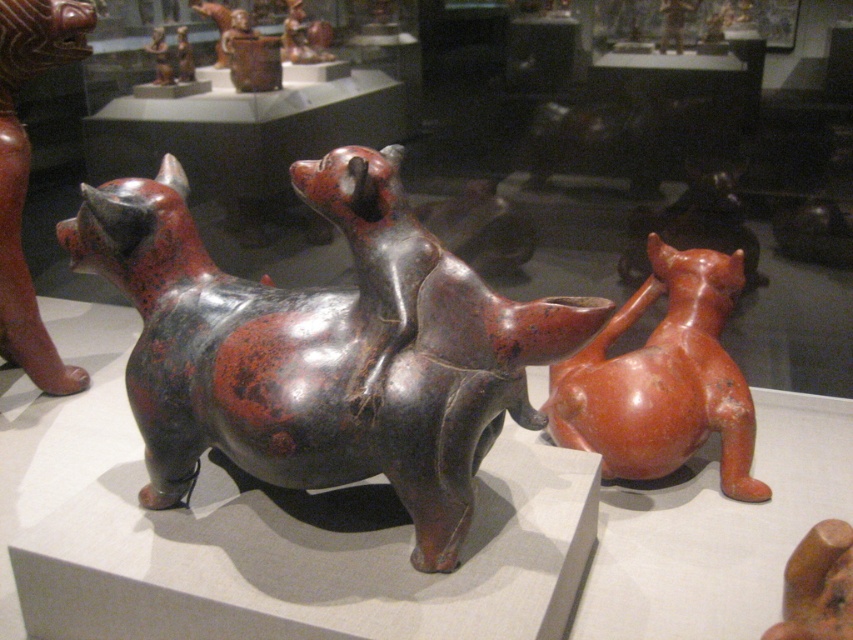
You are a museum curator who needs to move the matte black dog at center and the matte black cat at left closer together to fit them into a smaller display case. Currently, how far apart are these two figurines?

The matte black dog at center and the matte black cat at left are 1.54 meters apart from each other.

What object is located at the coordinates point (322, 348)?

The point (322, 348) corresponds to the matte black dog at center.

In the scene shown: You are an art curator planning to place a new rectangular display panel between the matte black dog at center and the matte black cat at left. The panel is 1.2 meters wide. Can the panel fit between them without overlapping either figurine?

The matte black dog at center is wider than the matte black cat at left. Since the panel is 1.2 meters wide, but the exact distance between them isn not provided, we cannot confirm if the panel will fit. More information is needed about the space between the two figurines.